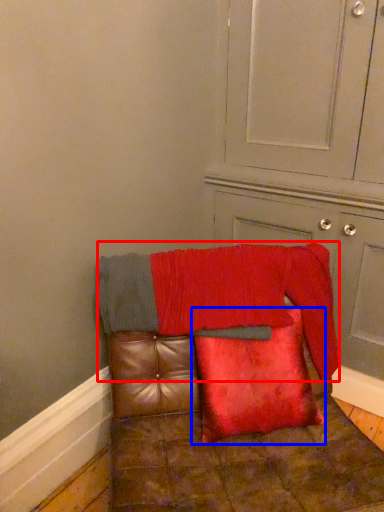
Question: Which object is further to the camera taking this photo, blanket (highlighted by a red box) or pillow (highlighted by a blue box)?

Choices:
 (A) blanket
 (B) pillow

Answer: (A)